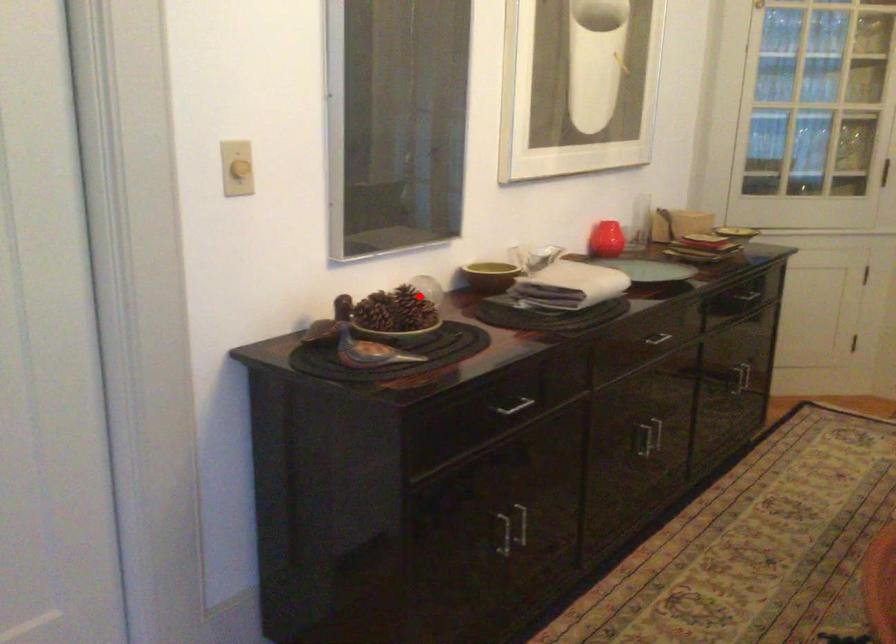
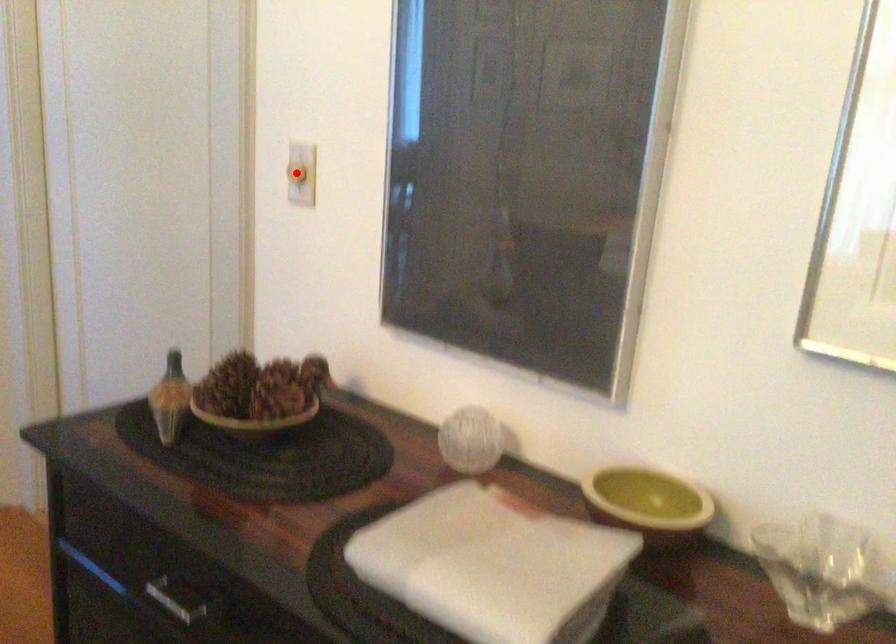
I am providing you with two images of the same scene from different viewpoints. A red point is marked on the first image and another point is marked on the second image. Does the point marked in image1 correspond to the same location as the one in image2?

No